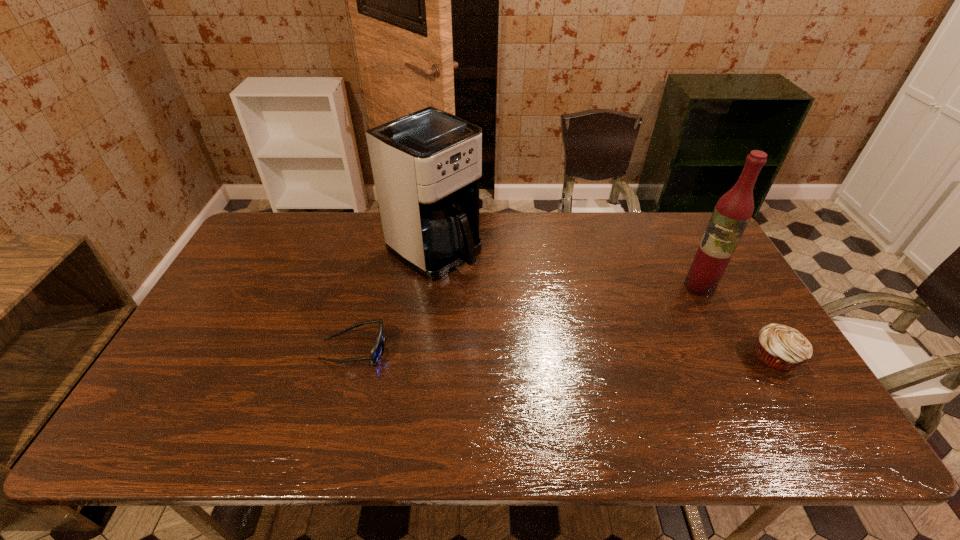
Locate an element on the screen. This screenshot has height=540, width=960. free region located 0.210m on the label of the liquor is located at coordinates (644, 323).

The height and width of the screenshot is (540, 960). I want to click on vacant point located on the label of the liquor, so coord(617,341).

Where is `object located at the far edge`? This screenshot has height=540, width=960. object located at the far edge is located at coordinates (426, 165).

Identify the location of object present at the near edge. (782, 348).

Locate an element on the screen. This screenshot has width=960, height=540. muffin at the right edge is located at coordinates (782, 348).

You are a GUI agent. You are given a task and a screenshot of the screen. Output one action in this format:
    pyautogui.click(x=<x>, y=<y>)
    Task: Click on the liquor present at the right edge
    This screenshot has height=540, width=960.
    Given the screenshot: What is the action you would take?
    pyautogui.click(x=732, y=213)

Image resolution: width=960 pixels, height=540 pixels. I want to click on object present at the near right corner, so click(782, 348).

You are a GUI agent. You are given a task and a screenshot of the screen. Output one action in this format:
    pyautogui.click(x=<x>, y=<y>)
    Task: Click on the free space at the far edge of the desktop
    
    Given the screenshot: What is the action you would take?
    pyautogui.click(x=651, y=220)

In the image, there is a desktop. Where is `free region at the near edge`? Image resolution: width=960 pixels, height=540 pixels. free region at the near edge is located at coordinates (308, 400).

At what (x,y) coordinates should I click in order to perform the action: click on vacant space at the left edge of the desktop. Please return your answer as a coordinate pair (x, y). This screenshot has width=960, height=540. Looking at the image, I should click on (x=224, y=290).